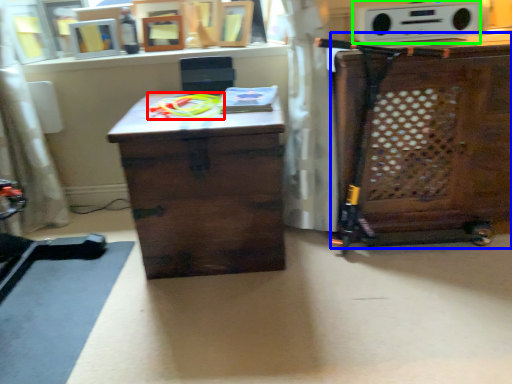
Question: Based on their relative distances, which object is farther from toy (highlighted by a red box)? Choose from cabinetry (highlighted by a blue box) and stereo (highlighted by a green box).

Choices:
 (A) cabinetry
 (B) stereo

Answer: (A)